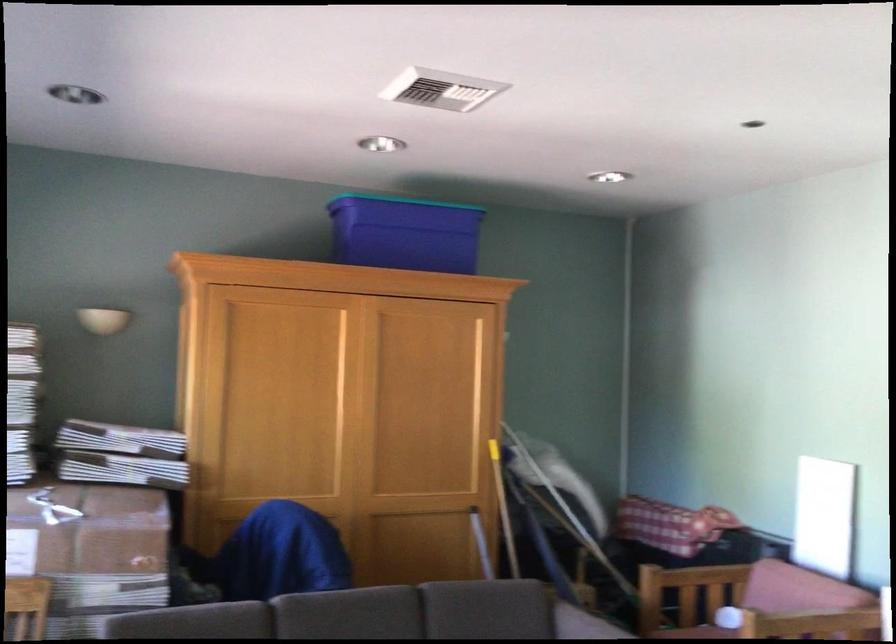
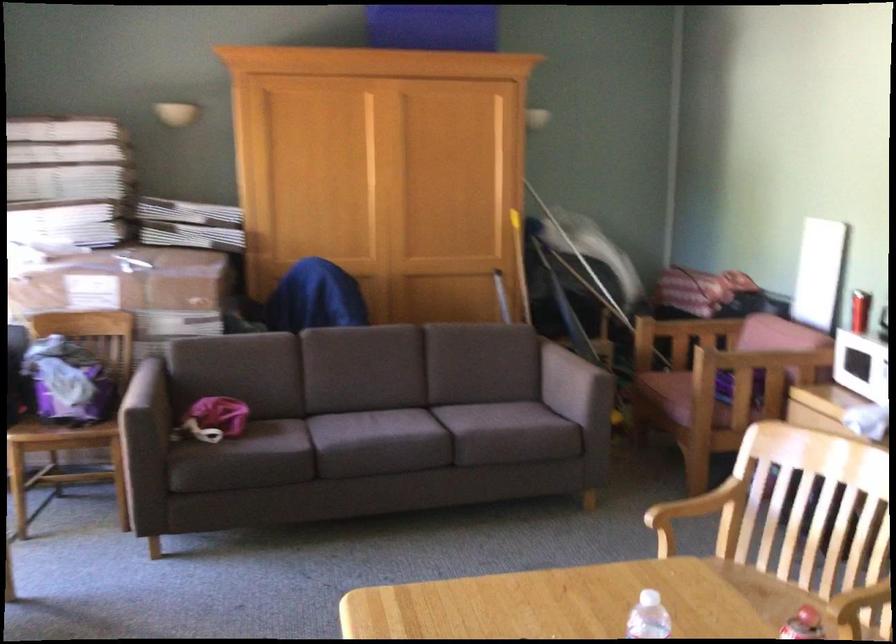
Question: The first image is from the beginning of the video and the second image is from the end. How did the camera likely rotate when shooting the video?

Choices:
 (A) Left
 (B) Right
 (C) Up
 (D) Down

Answer: (D)